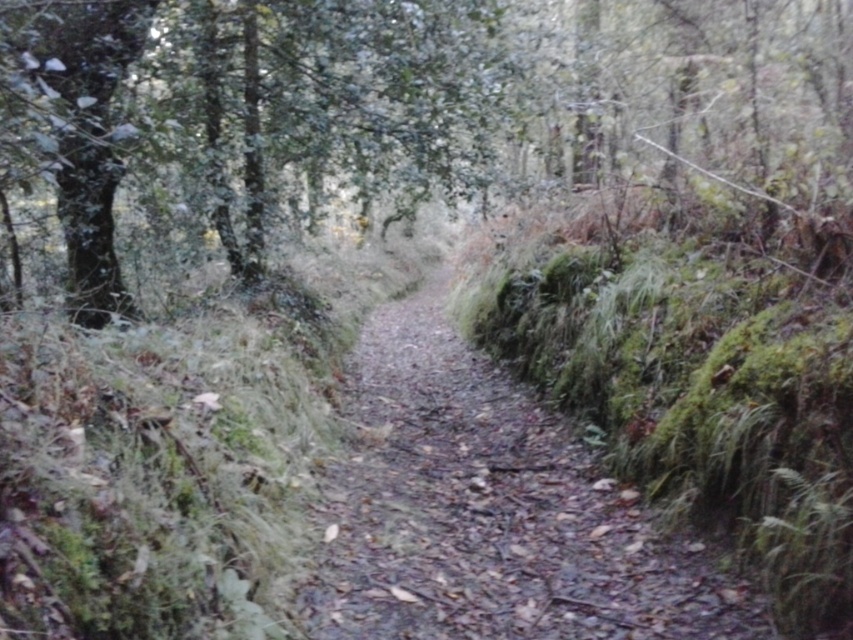
Does green mossy tree at center appear under damp dirt path at center?

No, green mossy tree at center is not below damp dirt path at center.

Does green mossy tree at center have a smaller size compared to damp dirt path at center?

Incorrect, green mossy tree at center is not smaller in size than damp dirt path at center.

The width and height of the screenshot is (853, 640). What do you see at coordinates (387, 115) in the screenshot?
I see `green mossy tree at center` at bounding box center [387, 115].

This screenshot has width=853, height=640. I want to click on green mossy tree at center, so click(387, 115).

Can you confirm if damp dirt path at center is smaller than green mossy tree at upper left?

No.

The width and height of the screenshot is (853, 640). In order to click on damp dirt path at center in this screenshot , I will do `click(491, 512)`.

In the scene shown: Who is more forward, (36, 161) or (62, 74)?

Positioned in front is point (36, 161).

Which is above, green mossy tree at center or green mossy tree at upper left?

green mossy tree at center is higher up.

Is point (183, 224) positioned in front of point (90, 58)?

No.

The image size is (853, 640). In order to click on green mossy tree at center in this screenshot , I will do `click(387, 115)`.